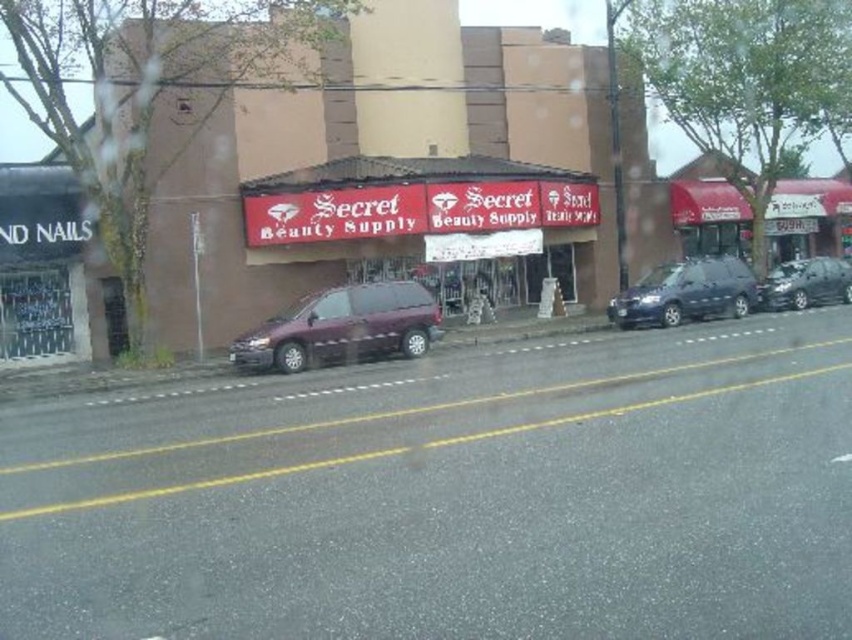
Question: Which of these objects is positioned farthest from the satin black minivan at center?

Choices:
 (A) matte purple van at center
 (B) purple matte van at center

Answer: (A)

Question: Can you confirm if satin black minivan at center is wider than shiny black sedan at center?

Choices:
 (A) no
 (B) yes

Answer: (B)

Question: Does purple matte van at center have a lesser width compared to matte purple van at center?

Choices:
 (A) no
 (B) yes

Answer: (A)

Question: Which of the following is the closest to the observer?

Choices:
 (A) shiny black sedan at center
 (B) purple matte van at center

Answer: (B)

Question: Based on their relative distances, which object is nearer to the satin black minivan at center?

Choices:
 (A) purple matte van at center
 (B) shiny black sedan at center

Answer: (B)

Question: From the image, what is the correct spatial relationship of satin black minivan at center in relation to shiny black sedan at center?

Choices:
 (A) below
 (B) above

Answer: (B)